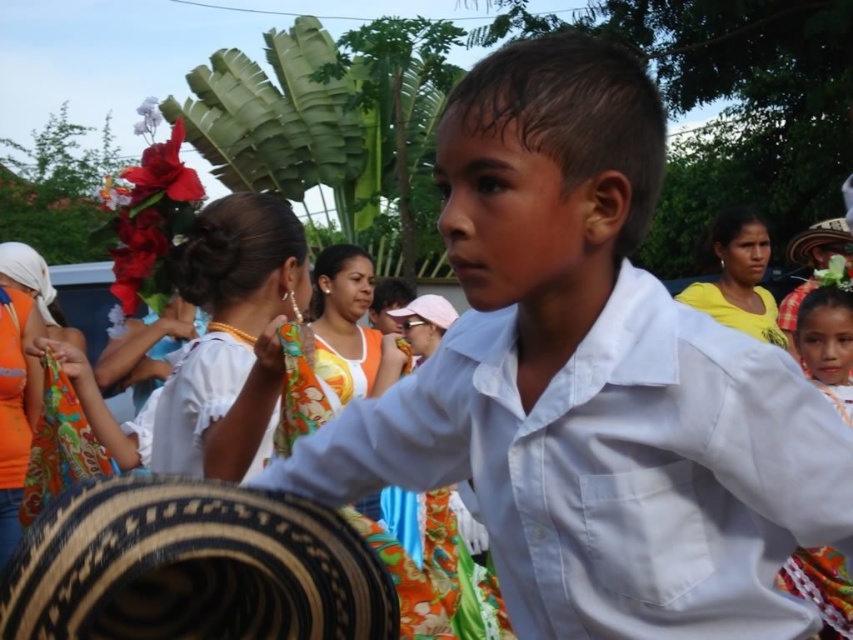
You are a photographer trying to capture the boy in the white cotton shirt at center while also including the black woven sombrero at lower left in the frame. Based on their positions, will you need to adjust your camera angle upwards or downwards to include both?

The black woven sombrero at lower left is located below the white cotton shirt at center. To include both in the frame, you would need to adjust your camera angle downwards to capture the sombrero at lower left which is positioned below the shirt at center.

You are a photographer trying to capture the boy in the white matte shirt at center and the person in the white cotton shirt at center. Which one is positioned lower in the image?

The white matte shirt at center is located below the white cotton shirt at center, so the white matte shirt at center is positioned lower in the image.